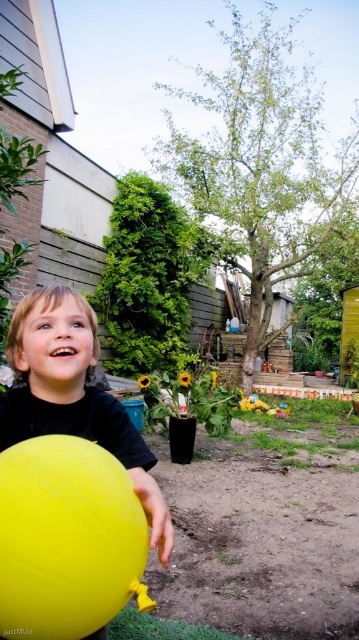
Can you confirm if yellow rubber balloon at lower left is shorter than yellow rubber balloon at center?

Yes.

Is yellow rubber balloon at lower left wider than yellow rubber balloon at center?

In fact, yellow rubber balloon at lower left might be narrower than yellow rubber balloon at center.

This screenshot has width=359, height=640. I want to click on yellow rubber balloon at lower left, so click(x=67, y=538).

Is yellow rubber balloon at lower left in front of plastic yellow toy at lower center?

Yes, it is in front of plastic yellow toy at lower center.

Does point (15, 561) lie in front of point (249, 404)?

Yes, it is in front of point (249, 404).

What do you see at coordinates (67, 538) in the screenshot? Image resolution: width=359 pixels, height=640 pixels. I see `yellow rubber balloon at lower left` at bounding box center [67, 538].

Identify the location of yellow rubber balloon at lower left. The image size is (359, 640). (67, 538).

Does yellow rubber balloon at center have a lesser width compared to plastic yellow toy at lower center?

In fact, yellow rubber balloon at center might be wider than plastic yellow toy at lower center.

Is point (44, 369) in front of point (249, 408)?

Yes, it is in front of point (249, 408).

Does point (85, 305) come in front of point (246, 397)?

Yes.

Locate an element on the screen. The width and height of the screenshot is (359, 640). yellow rubber balloon at center is located at coordinates (72, 394).